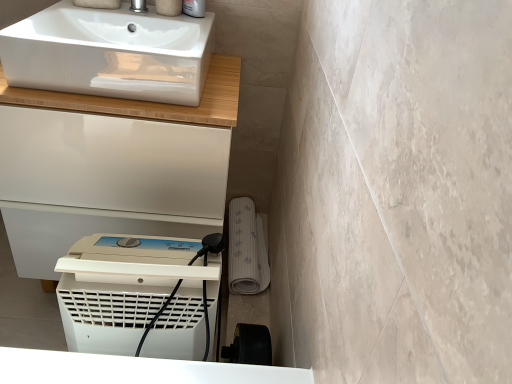
Question: From the image's perspective, is white plastic dehumidifier at lower center located above or below white glossy cabinet at upper left?

Choices:
 (A) above
 (B) below

Answer: (B)

Question: From a real-world perspective, is white plastic dehumidifier at lower center positioned above or below white glossy cabinet at upper left?

Choices:
 (A) below
 (B) above

Answer: (A)

Question: Which object is the farthest from the white glossy cabinet at upper left?

Choices:
 (A) white plastic dehumidifier at lower center
 (B) white glossy sink at upper left
 (C) satin nickel faucet at upper center

Answer: (A)

Question: Estimate the real-world distances between objects in this image. Which object is farther from the white plastic dehumidifier at lower center?

Choices:
 (A) satin nickel faucet at upper center
 (B) white glossy sink at upper left
 (C) white glossy cabinet at upper left

Answer: (A)